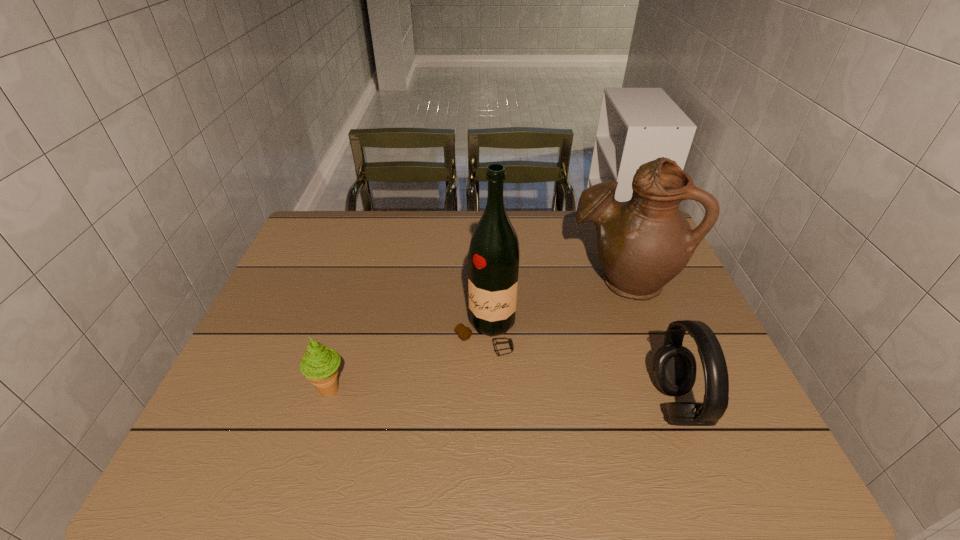
Locate an element on the screen. This screenshot has height=540, width=960. icecream is located at coordinates (319, 365).

The height and width of the screenshot is (540, 960). What are the coordinates of `the shortest object` in the screenshot? It's located at (319, 365).

The height and width of the screenshot is (540, 960). Find the location of `headset`. headset is located at coordinates (674, 366).

At what (x,y) coordinates should I click in order to perform the action: click on pitcher. Please return your answer as a coordinate pair (x, y). Looking at the image, I should click on (643, 243).

Locate an element on the screen. This screenshot has height=540, width=960. wine bottle is located at coordinates (493, 260).

The height and width of the screenshot is (540, 960). Find the location of `free point located on the back of the leftmost object`. free point located on the back of the leftmost object is located at coordinates (367, 267).

The height and width of the screenshot is (540, 960). In order to click on vacant area situated on the earcups of the second shortest object in this screenshot , I will do `click(727, 404)`.

The width and height of the screenshot is (960, 540). In order to click on free space located at the spout of the third shortest object in this screenshot , I will do `click(568, 321)`.

Locate an element on the screen. vacant area located 0.140m at the spout of the third shortest object is located at coordinates (559, 328).

Locate an element on the screen. This screenshot has height=540, width=960. vacant space situated 0.100m at the spout of the third shortest object is located at coordinates (568, 321).